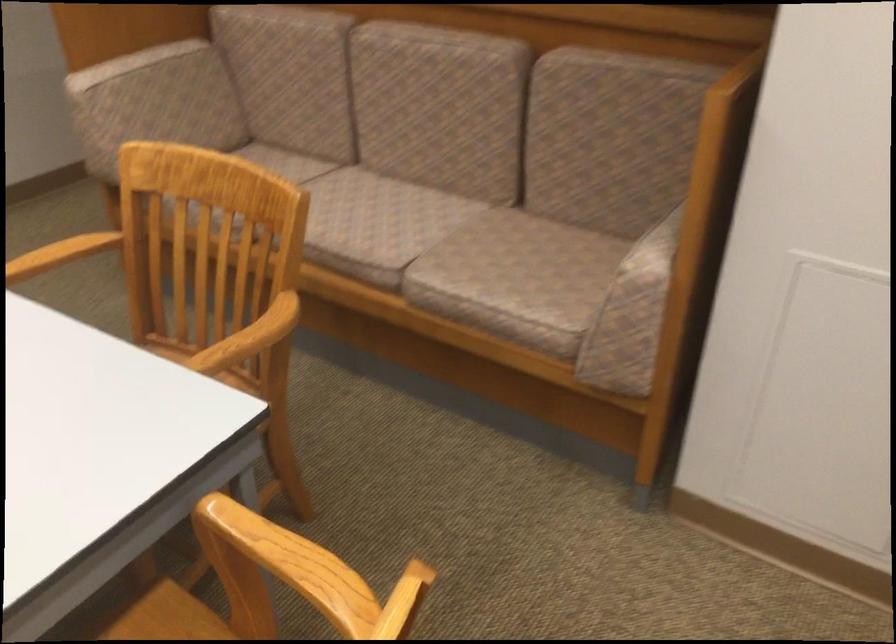
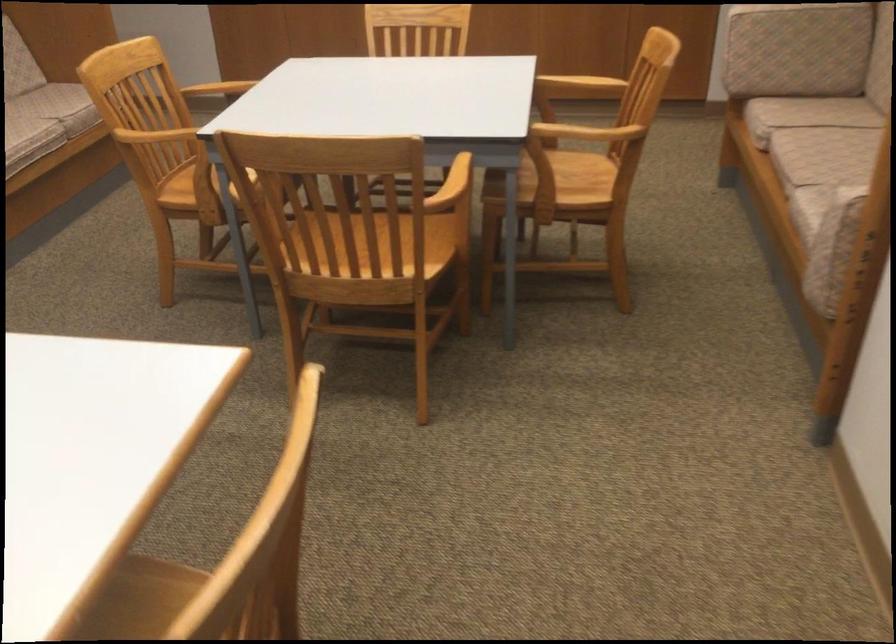
The point at (448,267) is marked in the first image. Where is the corresponding point in the second image?

(822, 190)